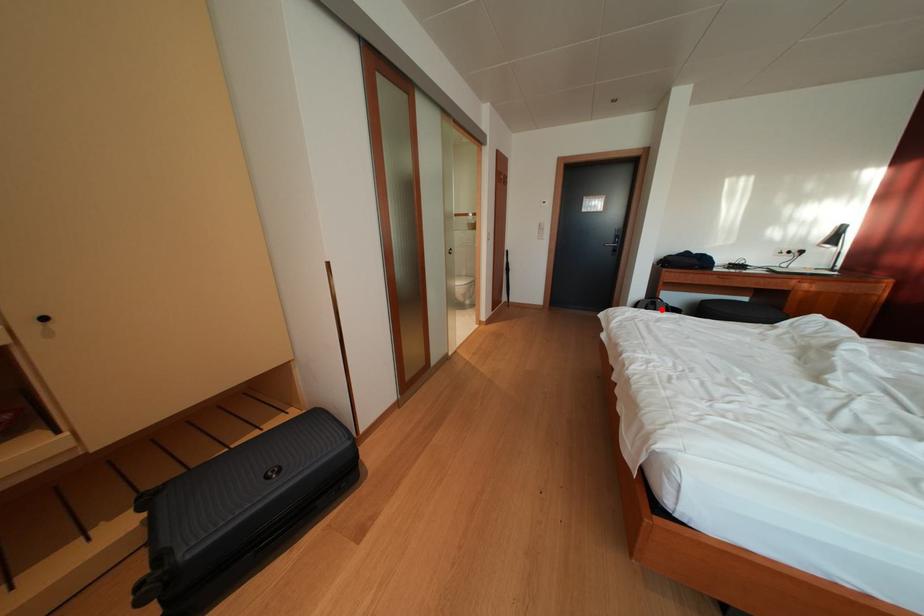
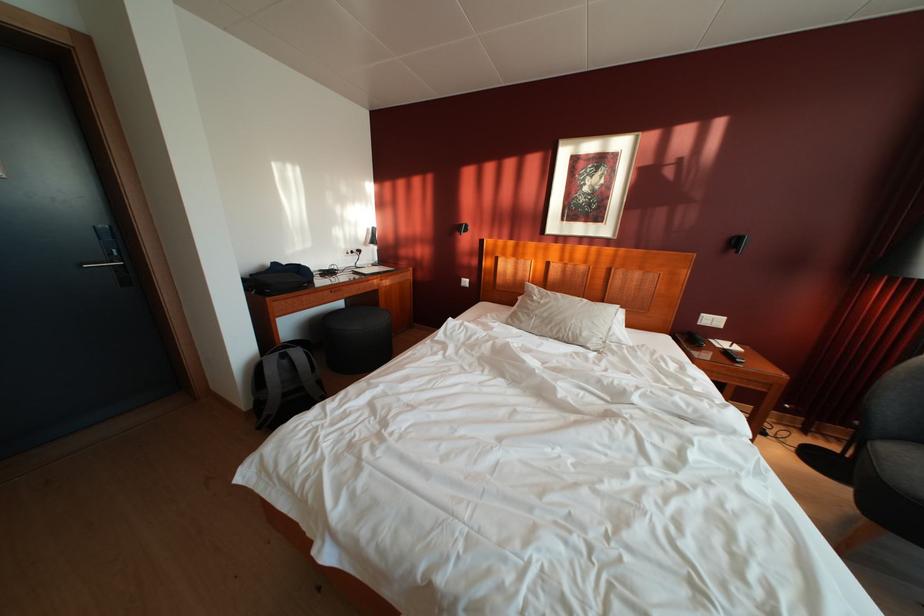
Question: I am providing you with two images of the same scene from different viewpoints. In image1, a red point is highlighted. Considering the same 3D point in image2, which of the following is correct?

Choices:
 (A) It is closer
 (B) It is farther

Answer: (A)